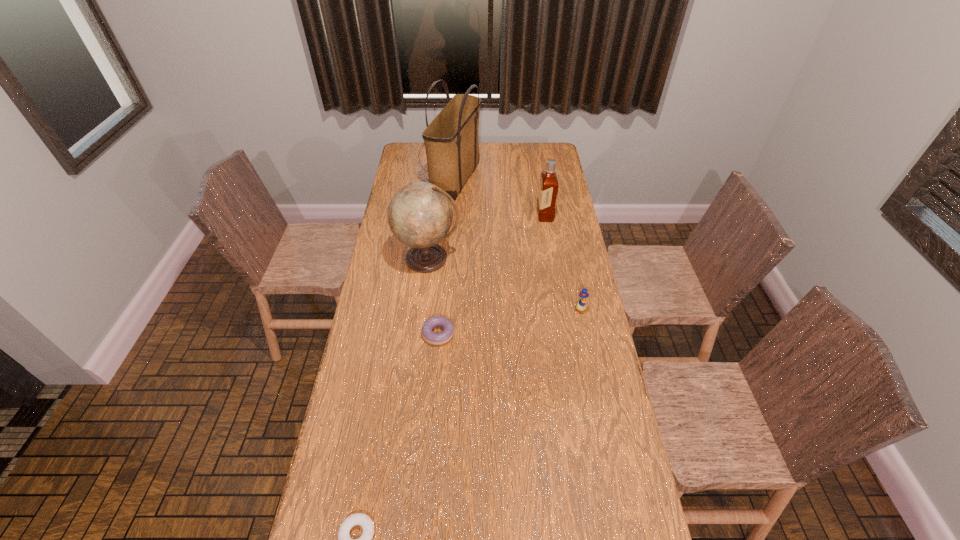
Find the location of `free spot between the farther doughnut and the liquor`. free spot between the farther doughnut and the liquor is located at coordinates [x=492, y=274].

I want to click on blank region between the duckling and the fifth object from left to right, so coord(563,263).

This screenshot has width=960, height=540. I want to click on the closest object to the nearest object, so click(x=429, y=336).

This screenshot has height=540, width=960. Find the location of `object that is the second nearest to the right doughnut`. object that is the second nearest to the right doughnut is located at coordinates (581, 305).